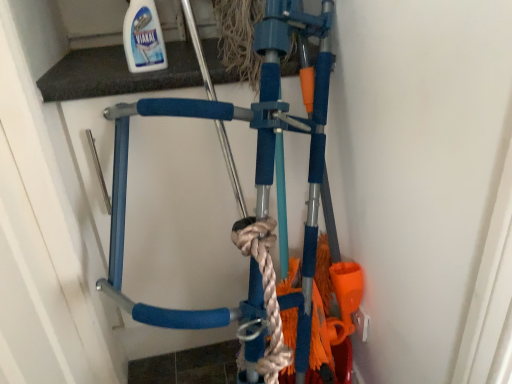
Image resolution: width=512 pixels, height=384 pixels. Find the location of `free spot to the left of white glossy bottle at upper center`. free spot to the left of white glossy bottle at upper center is located at coordinates (89, 71).